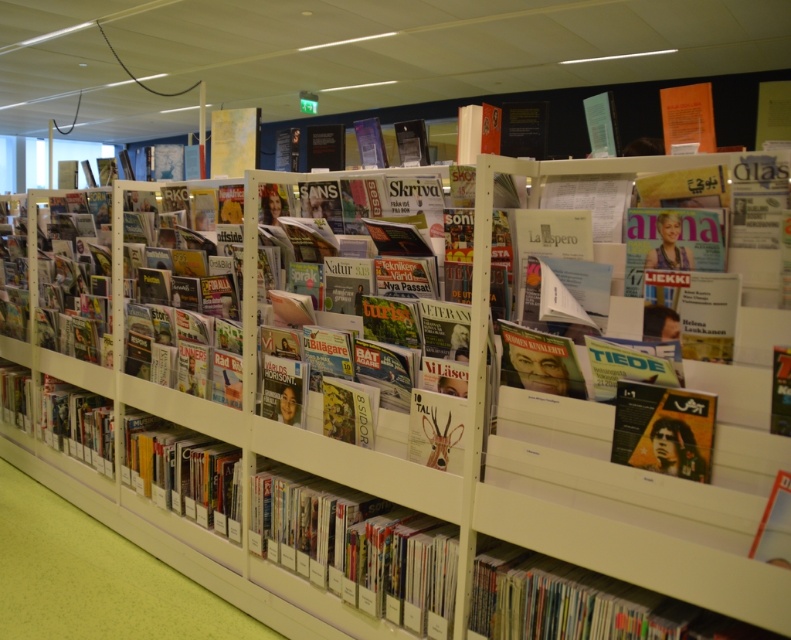
Does matte cardboard book at lower right have a lesser height compared to matte black book at lower left?

Correct, matte cardboard book at lower right is not as tall as matte black book at lower left.

Which is below, matte cardboard book at lower right or matte black book at lower left?

matte cardboard book at lower right

Identify the location of matte cardboard book at lower right. (581, 604).

Can you confirm if yellow matte book at center is positioned above matte black book at lower left?

No.

Image resolution: width=791 pixels, height=640 pixels. What do you see at coordinates (184, 472) in the screenshot?
I see `yellow matte book at center` at bounding box center [184, 472].

Locate an element on the screen. This screenshot has height=640, width=791. yellow matte book at center is located at coordinates (184, 472).

Identify the location of yellow matte book at center. This screenshot has width=791, height=640. (184, 472).

Is matte plastic books at center smaller than matte cardboard book at lower right?

No.

Is matte plastic books at center bigger than matte cardboard book at lower right?

Correct, matte plastic books at center is larger in size than matte cardboard book at lower right.

Is point (347, 532) closer to viewer compared to point (502, 573)?

No, (347, 532) is behind (502, 573).

Where is `matte plastic books at center`? matte plastic books at center is located at coordinates (354, 547).